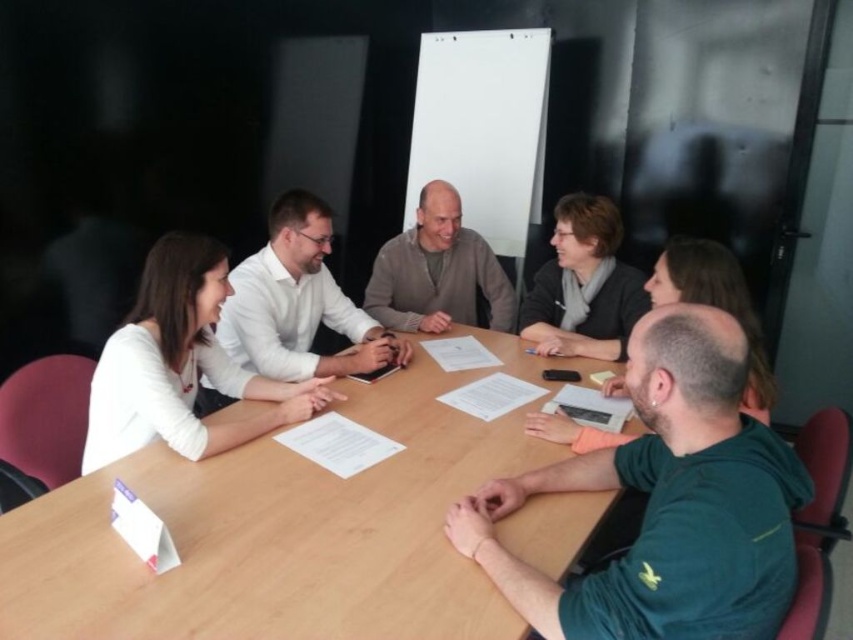
Question: Is green fabric shirt at lower right to the left of matte gray sweater at upper center from the viewer's perspective?

Choices:
 (A) no
 (B) yes

Answer: (B)

Question: From the image, what is the correct spatial relationship of wooden table at center in relation to white shirt at upper left?

Choices:
 (A) above
 (B) below

Answer: (B)

Question: Which object appears closest to the camera in this image?

Choices:
 (A) wooden table at center
 (B) white shirt at upper left
 (C) white matte shirt at upper left

Answer: (A)

Question: Which object is farther from the camera taking this photo?

Choices:
 (A) white shirt at upper left
 (B) white matte shirt at upper left
 (C) matte gray sweater at upper center
 (D) wooden table at center

Answer: (C)

Question: Among these points, which one is nearest to the camera?

Choices:
 (A) (471, 428)
 (B) (252, 282)
 (C) (712, 262)

Answer: (C)

Question: Is white matte shirt at upper left to the right of dark gray sweater at upper right from the viewer's perspective?

Choices:
 (A) yes
 (B) no

Answer: (B)